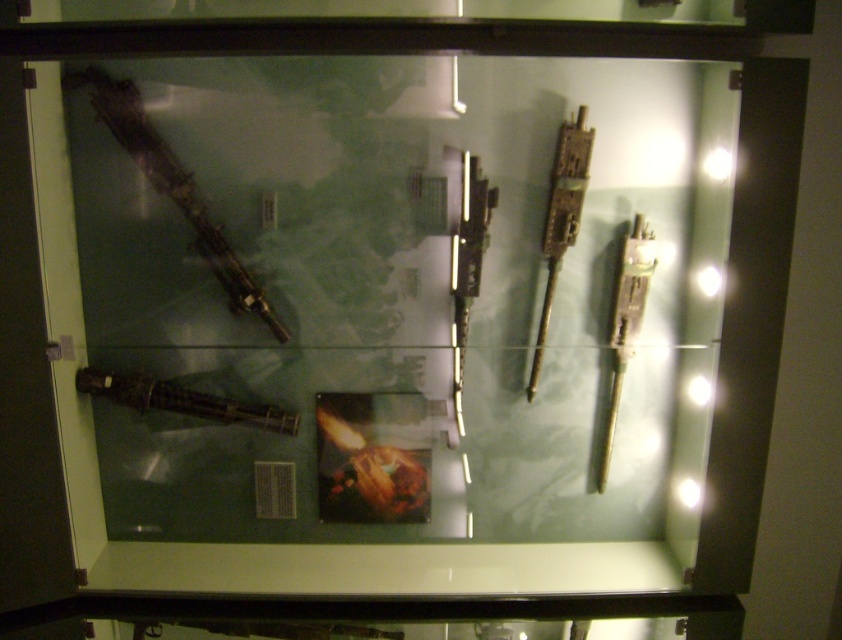
Question: Based on their relative distances, which object is farther from the matte black sword at lower left?

Choices:
 (A) green metallic sword at right
 (B) matte black gun at left
 (C) rusty metal gun at upper right
 (D) metallic silver gun at center

Answer: (A)

Question: Can you confirm if rusty metal gun at upper right is smaller than matte black sword at lower left?

Choices:
 (A) yes
 (B) no

Answer: (B)

Question: Which object is positioned farthest from the rusty metal gun at upper right?

Choices:
 (A) matte black gun at left
 (B) green metallic sword at right

Answer: (A)

Question: Is rusty metal gun at upper right bigger than green metallic sword at right?

Choices:
 (A) no
 (B) yes

Answer: (B)

Question: Which is farther from the metallic silver gun at center?

Choices:
 (A) rusty metal gun at upper right
 (B) matte black sword at lower left
 (C) matte black gun at left
 (D) green metallic sword at right

Answer: (B)

Question: Can you confirm if metallic silver gun at center is bigger than matte black sword at lower left?

Choices:
 (A) no
 (B) yes

Answer: (B)